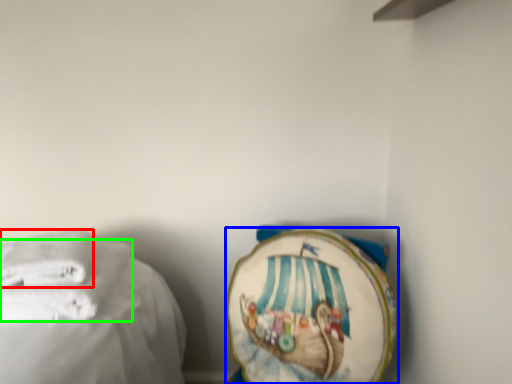
Question: Which object is positioned closest to towel (highlighted by a red box)? Select from towel (highlighted by a blue box) and towel (highlighted by a green box).

Choices:
 (A) towel
 (B) towel

Answer: (B)